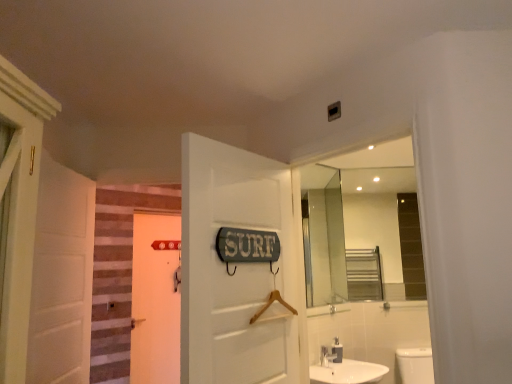
Locate an element on the screen. green painted wood door at center, the third door when ordered from back to front is located at coordinates (237, 268).

Where is `metallic silver soap dispenser at lower center`? metallic silver soap dispenser at lower center is located at coordinates (337, 351).

Find the location of a particular element. sink that appears on the right of green painted wood door at center, which appears as the first door when viewed from the front is located at coordinates (344, 368).

Consider the image. From a real-world perspective, relative to white glossy sink at lower center, is green painted wood door at center, which is counted as the third door, starting from the left, vertically above or below?

In terms of real-world spatial position, green painted wood door at center, which is counted as the third door, starting from the left, is above white glossy sink at lower center.

Which is behind, point (275, 193) or point (331, 369)?

The point (331, 369) is farther.

Consider the image. Is green painted wood door at center, which is counted as the third door, starting from the left, facing away from white glossy sink at lower center?

No, green painted wood door at center, which is counted as the third door, starting from the left, is not facing the opposite direction of white glossy sink at lower center.

Is white glossy sink at lower center thinner than white matte door at center, the second door when ordered from right to left?

In fact, white glossy sink at lower center might be wider than white matte door at center, the second door when ordered from right to left.

Would you say white glossy sink at lower center contains white matte door at center, which is the 3th door in front-to-back order?

Actually, white matte door at center, which is the 3th door in front-to-back order, is outside white glossy sink at lower center.

Is white matte door at center, which ranks as the second door in left-to-right order, at the back of white glossy sink at lower center?

Yes, white glossy sink at lower center is facing away from white matte door at center, which ranks as the second door in left-to-right order.

Is point (293, 281) closer or farther from the camera than point (170, 318)?

Point (293, 281) is closer to the camera than point (170, 318).

From the picture: Does green painted wood door at center, which appears as the first door when viewed from the front, contain white matte door at center, the second door when ordered from right to left?

Actually, white matte door at center, the second door when ordered from right to left, is outside green painted wood door at center, which appears as the first door when viewed from the front.

From a real-world perspective, is green painted wood door at center, which appears as the first door when viewed from the front, located beneath white matte door at center, the second door when ordered from right to left?

No, from a real-world perspective, green painted wood door at center, which appears as the first door when viewed from the front, is not under white matte door at center, the second door when ordered from right to left.

Is green painted wood door at center, the third door when ordered from back to front, oriented away from white matte door at center, the second door when ordered from right to left?

No, green painted wood door at center, the third door when ordered from back to front,'s orientation is not away from white matte door at center, the second door when ordered from right to left.

Would you say brown striped carpet at left is to the left or to the right of white glossy sink at lower center in the picture?

Based on their positions, brown striped carpet at left is located to the left of white glossy sink at lower center.

Is point (112, 209) positioned before point (317, 366)?

No.

Are brown striped carpet at left and white glossy sink at lower center making contact?

No, brown striped carpet at left is not in contact with white glossy sink at lower center.

Does brown striped carpet at left have a smaller size compared to white glossy sink at lower center?

Yes.

From the picture: Is white matte door at left, the 2th door from the front, beside green painted wood door at center, which appears as the first door when viewed from the front?

white matte door at left, the 2th door from the front, and green painted wood door at center, which appears as the first door when viewed from the front, are not in contact.

Based on the photo, between white matte door at left, the 1th door in the left-to-right sequence, and green painted wood door at center, which is counted as the third door, starting from the left, which one has less height?

With less height is green painted wood door at center, which is counted as the third door, starting from the left.

How much distance is there between white matte door at left, arranged as the second door when viewed from the back, and green painted wood door at center, which appears as the first door when viewed from the front?

white matte door at left, arranged as the second door when viewed from the back, and green painted wood door at center, which appears as the first door when viewed from the front, are 34.01 inches apart.

From a real-world perspective, is brown striped carpet at left physically located above or below white matte door at left, the 3th door in the right-to-left sequence?

From a real-world perspective, brown striped carpet at left is physically below white matte door at left, the 3th door in the right-to-left sequence.

Considering the sizes of brown striped carpet at left and white matte door at left, the 1th door in the left-to-right sequence, in the image, is brown striped carpet at left wider or thinner than white matte door at left, the 1th door in the left-to-right sequence,?

In the image, brown striped carpet at left appears to be more narrow than white matte door at left, the 1th door in the left-to-right sequence.

Could white matte door at left, arranged as the second door when viewed from the back, be considered to be inside brown striped carpet at left?

No, white matte door at left, arranged as the second door when viewed from the back, is not surrounded by brown striped carpet at left.

Where is `stairwell located underneath the white matte door at left, the 1th door in the left-to-right sequence (from a real-world perspective)`? stairwell located underneath the white matte door at left, the 1th door in the left-to-right sequence (from a real-world perspective) is located at coordinates (119, 273).

Find the location of `toiletry below the green painted wood door at center, acting as the 1th door starting from the right (from a real-world perspective)`. toiletry below the green painted wood door at center, acting as the 1th door starting from the right (from a real-world perspective) is located at coordinates (337, 351).

Is metallic silver soap dispenser at lower center oriented towards green painted wood door at center, which appears as the first door when viewed from the front?

No, metallic silver soap dispenser at lower center is not aimed at green painted wood door at center, which appears as the first door when viewed from the front.

From the image's perspective, does metallic silver soap dispenser at lower center appear higher than green painted wood door at center, acting as the 1th door starting from the right?

Actually, metallic silver soap dispenser at lower center appears below green painted wood door at center, acting as the 1th door starting from the right, in the image.

Can green painted wood door at center, which appears as the first door when viewed from the front, be found inside metallic silver soap dispenser at lower center?

Definitely not — green painted wood door at center, which appears as the first door when viewed from the front, is not inside metallic silver soap dispenser at lower center.

In the image, there is a green painted wood door at center, acting as the 1th door starting from the right. At what (x,y) coordinates should I click in order to perform the action: click on sink below it (from a real-world perspective). Please return your answer as a coordinate pair (x, y). The image size is (512, 384). Looking at the image, I should click on (344, 368).

From the white glossy sink at lower center, count the 2nd door to the left and point to it. Please provide its 2D coordinates.

[(155, 300)]

Considering their positions, is white matte door at center, the second door when ordered from right to left, positioned further to brown striped carpet at left than white matte door at left, the 3th door in the right-to-left sequence?

Based on the image, white matte door at left, the 3th door in the right-to-left sequence, appears to be further to brown striped carpet at left.

Which object lies further to the anchor point white glossy sink at lower center, white matte door at left, the 1th door in the left-to-right sequence, or metallic silver soap dispenser at lower center?

white matte door at left, the 1th door in the left-to-right sequence, is further to white glossy sink at lower center.

From the image, which object appears to be nearer to white glossy sink at lower center, white matte door at left, the 3th door in the right-to-left sequence, or white matte door at center, which ranks as the second door in left-to-right order?

white matte door at left, the 3th door in the right-to-left sequence, is closer to white glossy sink at lower center.

Based on their spatial positions, is green painted wood door at center, the third door when ordered from back to front, or white matte door at center, which ranks as the second door in left-to-right order, closer to white glossy sink at lower center?

green painted wood door at center, the third door when ordered from back to front, lies closer to white glossy sink at lower center than the other object.

Consider the image. Estimate the real-world distances between objects in this image. Which object is further from white glossy sink at lower center, white matte door at center, the first door in the back-to-front sequence, or brown striped carpet at left?

Among the two, brown striped carpet at left is located further to white glossy sink at lower center.

Looking at the image, which one is located further to metallic silver soap dispenser at lower center, white matte door at center, which ranks as the second door in left-to-right order, or white matte door at left, the 2th door from the front?

white matte door at center, which ranks as the second door in left-to-right order, lies further to metallic silver soap dispenser at lower center than the other object.

From the image, which object appears to be farther from white matte door at left, the 2th door from the front, white matte door at center, which ranks as the second door in left-to-right order, or metallic silver soap dispenser at lower center?

Among the two, white matte door at center, which ranks as the second door in left-to-right order, is located further to white matte door at left, the 2th door from the front.

Based on their spatial positions, is brown striped carpet at left or white matte door at center, which ranks as the second door in left-to-right order, further from white matte door at left, arranged as the second door when viewed from the back?

white matte door at center, which ranks as the second door in left-to-right order.

Identify the location of stairwell between white matte door at left, the 1th door in the left-to-right sequence, and metallic silver soap dispenser at lower center. [x=119, y=273].

Locate an element on the screen. sink located between green painted wood door at center, acting as the 1th door starting from the right, and white matte door at center, which is the 3th door in front-to-back order, in the depth direction is located at coordinates (344, 368).

This screenshot has height=384, width=512. What are the coordinates of `stairwell between green painted wood door at center, acting as the 1th door starting from the right, and metallic silver soap dispenser at lower center from front to back` in the screenshot? It's located at (119, 273).

Where is `door between brown striped carpet at left and white glossy sink at lower center in the horizontal direction`? door between brown striped carpet at left and white glossy sink at lower center in the horizontal direction is located at coordinates (237, 268).